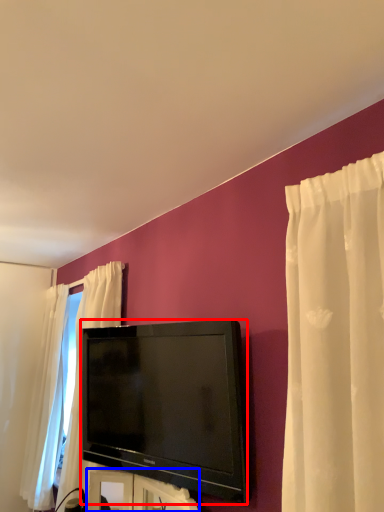
Question: Which object is closer to the camera taking this photo, television (highlighted by a red box) or furniture (highlighted by a blue box)?

Choices:
 (A) television
 (B) furniture

Answer: (B)